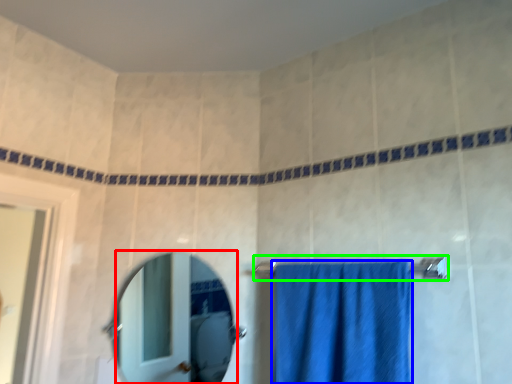
Question: Based on their relative distances, which object is nearer to mirror (highlighted by a red box)? Choose from towel (highlighted by a blue box) and towel bar (highlighted by a green box).

Choices:
 (A) towel
 (B) towel bar

Answer: (A)